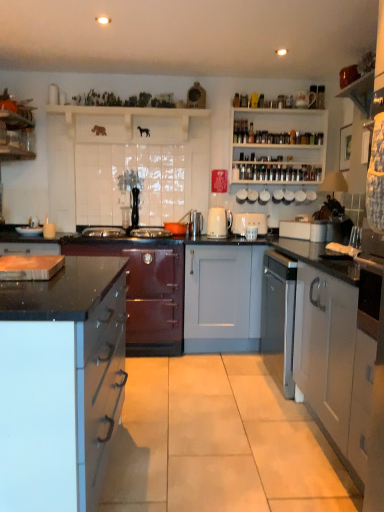
Question: Which direction should I rotate to look at white matte toaster at center, acting as the third appliance starting from the left, — up or down?

Choices:
 (A) down
 (B) up

Answer: (B)

Question: Considering the relative sizes of white wooden shelves at upper right, which ranks as the 1th shelf in right-to-left order, and white ceramic kettle at upper center, the fourth appliance viewed from the left, in the image provided, is white wooden shelves at upper right, which ranks as the 1th shelf in right-to-left order, bigger than white ceramic kettle at upper center, the fourth appliance viewed from the left,?

Choices:
 (A) yes
 (B) no

Answer: (A)

Question: Is white wooden shelves at upper right, which is counted as the 2th shelf, starting from the left, wider than white ceramic kettle at upper center, which is the 2th appliance from right to left?

Choices:
 (A) yes
 (B) no

Answer: (A)

Question: From the image's perspective, is white wooden shelves at upper right, which ranks as the 1th shelf in right-to-left order, located above white ceramic kettle at upper center, which is the 2th appliance from right to left?

Choices:
 (A) no
 (B) yes

Answer: (B)

Question: Is the depth of white wooden shelves at upper right, which ranks as the 1th shelf in right-to-left order, less than that of white ceramic kettle at upper center, which is the 2th appliance from right to left?

Choices:
 (A) yes
 (B) no

Answer: (A)

Question: Can white ceramic kettle at upper center, which is the 2th appliance from right to left, be found inside white wooden shelves at upper right, which is counted as the 2th shelf, starting from the left?

Choices:
 (A) yes
 (B) no

Answer: (A)

Question: Is white wooden shelves at upper right, which ranks as the 1th shelf in right-to-left order, shorter than white ceramic kettle at upper center, which is the 2th appliance from right to left?

Choices:
 (A) no
 (B) yes

Answer: (A)

Question: Is white ceramic mug at upper center, marked as the 2th appliance in a left-to-right arrangement, not inside white ceramic kettle at upper center, the fourth appliance viewed from the left?

Choices:
 (A) no
 (B) yes

Answer: (B)

Question: Are white ceramic mug at upper center, the 4th appliance positioned from the right, and white ceramic kettle at upper center, the fourth appliance viewed from the left, located far from each other?

Choices:
 (A) no
 (B) yes

Answer: (A)

Question: Is white ceramic mug at upper center, the 4th appliance positioned from the right, thinner than white ceramic kettle at upper center, the fourth appliance viewed from the left?

Choices:
 (A) no
 (B) yes

Answer: (B)

Question: From the image's perspective, is white ceramic mug at upper center, the 4th appliance positioned from the right, above white ceramic kettle at upper center, which is the 2th appliance from right to left?

Choices:
 (A) yes
 (B) no

Answer: (B)

Question: Is white ceramic mug at upper center, the 4th appliance positioned from the right, placed right next to white ceramic kettle at upper center, the fourth appliance viewed from the left?

Choices:
 (A) yes
 (B) no

Answer: (A)

Question: Considering the relative sizes of white ceramic mug at upper center, the 4th appliance positioned from the right, and white ceramic kettle at upper center, which is the 2th appliance from right to left, in the image provided, is white ceramic mug at upper center, the 4th appliance positioned from the right, shorter than white ceramic kettle at upper center, which is the 2th appliance from right to left,?

Choices:
 (A) yes
 (B) no

Answer: (A)

Question: From a real-world perspective, is white ceramic kettle at upper center, the fourth appliance viewed from the left, over shiny burgundy cabinet at center-left, the second cabinetry positioned from the left?

Choices:
 (A) yes
 (B) no

Answer: (A)